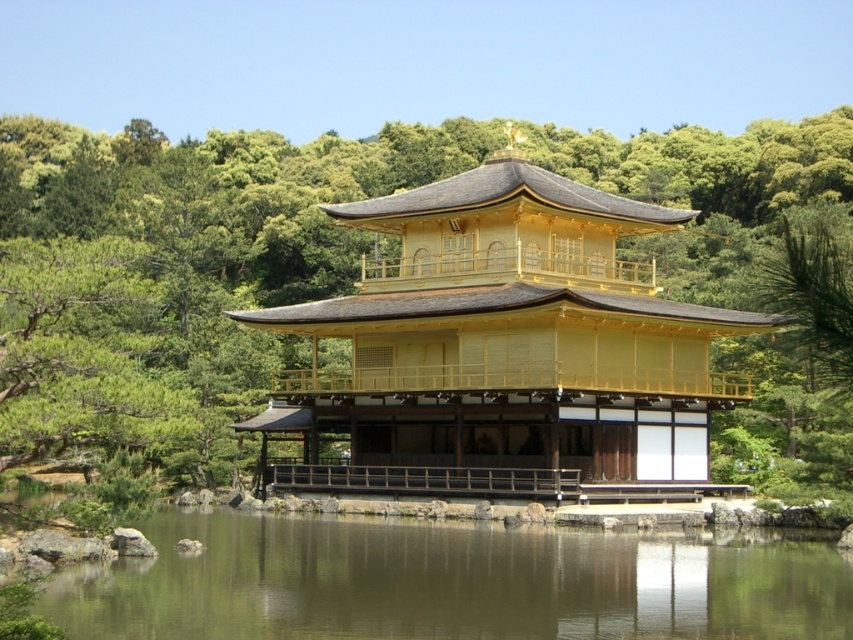
You are a tourist standing on the wooden path leading to the gold polished wood gazebo at center. You want to take a photo of the gazebo and its reflection in the green reflective water at lower center. Is the gazebo positioned in a way that its reflection can be captured in the water?

The gold polished wood gazebo at center is located above the green reflective water at lower center, so its reflection should be visible in the water, allowing you to capture it in your photo.

You are standing on the path leading to the gold polished wood gazebo at center and the green reflective water at lower center. Which direction should you walk to reach the gazebo first?

You should walk to the left because the gold polished wood gazebo at center is located to the left of the green reflective water at lower center, so it is closer to your current position.